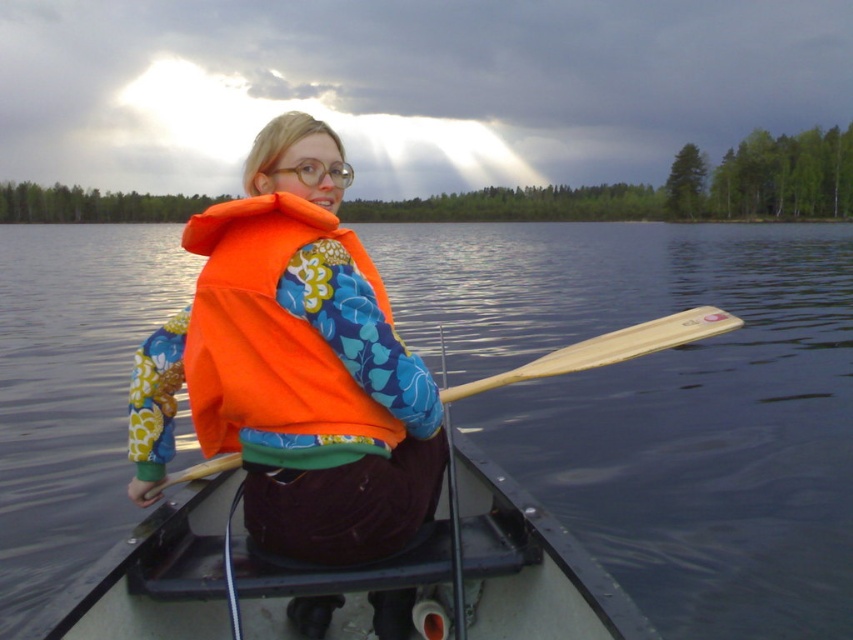
You are a safety inspector checking the equipment on the black plastic boat at center. You notice the orange fabric life vest at center. Based on their sizes, which one is more appropriate to ensure safety for the person in the water?

The black plastic boat at center is larger than the orange fabric life vest at center, so the life vest may not provide sufficient buoyancy for the person in the water. The boat is more appropriate for safety.

You are navigating a canoe and need to avoid a submerged rock. The transparent water at center is where you are currently paddling. Where should you steer to avoid the rock?

The transparent water at center is located at point (x=660, y=403), so you should steer away from that coordinate to avoid the submerged rock.

You are a safety inspector checking the canoe setup. The orange fabric life vest at center and the black plastic boat at center must be arranged properly. According to safety guidelines, the life vest should always be placed on the right side of the boat. Is the current arrangement compliant with safety regulations?

The orange fabric life vest at center is positioned on the left side of the black plastic boat at center, which violates the safety guideline requiring the life vest to be on the right side of the boat. The current arrangement is not compliant.